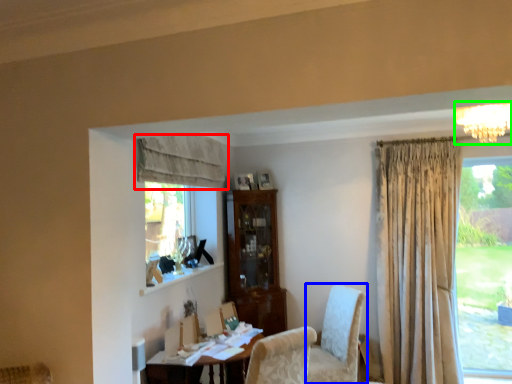
Question: Which is farther away from curtain (highlighted by a red box)? chair (highlighted by a blue box) or light fixture (highlighted by a green box)?

Choices:
 (A) chair
 (B) light fixture

Answer: (B)